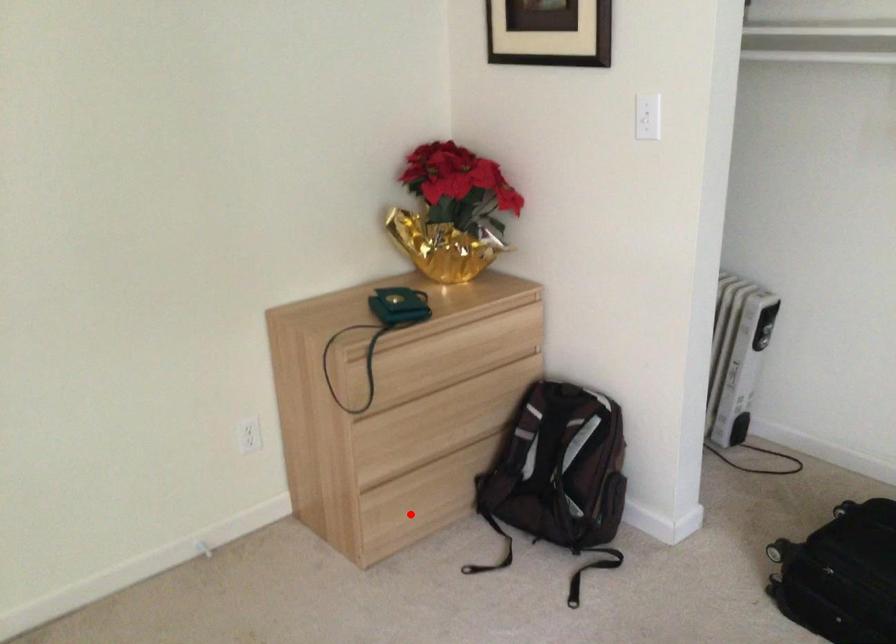
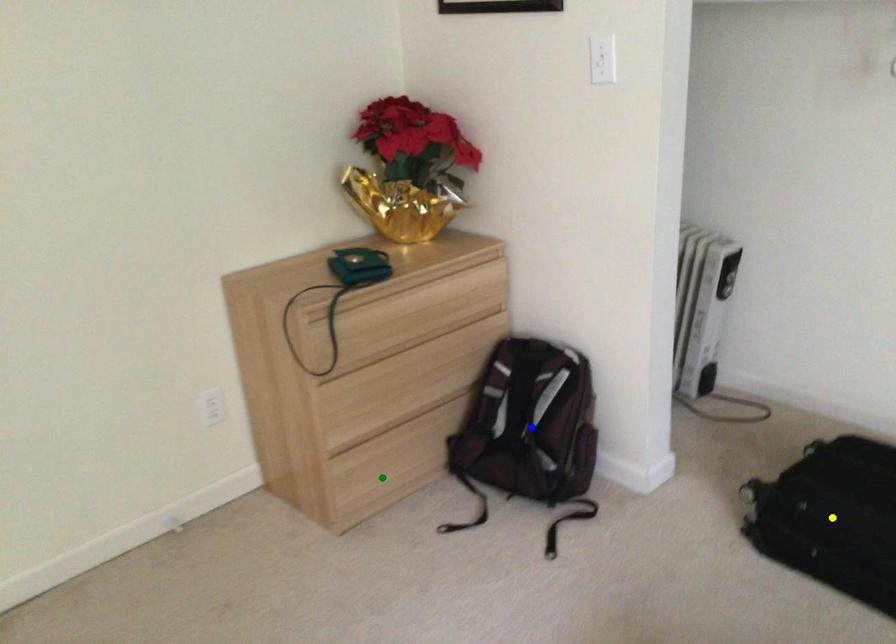
Question: I am providing you with two images of the same scene from different viewpoints. A red point is marked on the first image. You are given multiple points on the second image. In image 2, which mark is for the same physical point as the one in image 1?

Choices:
 (A) yellow point
 (B) green point
 (C) blue point

Answer: (B)